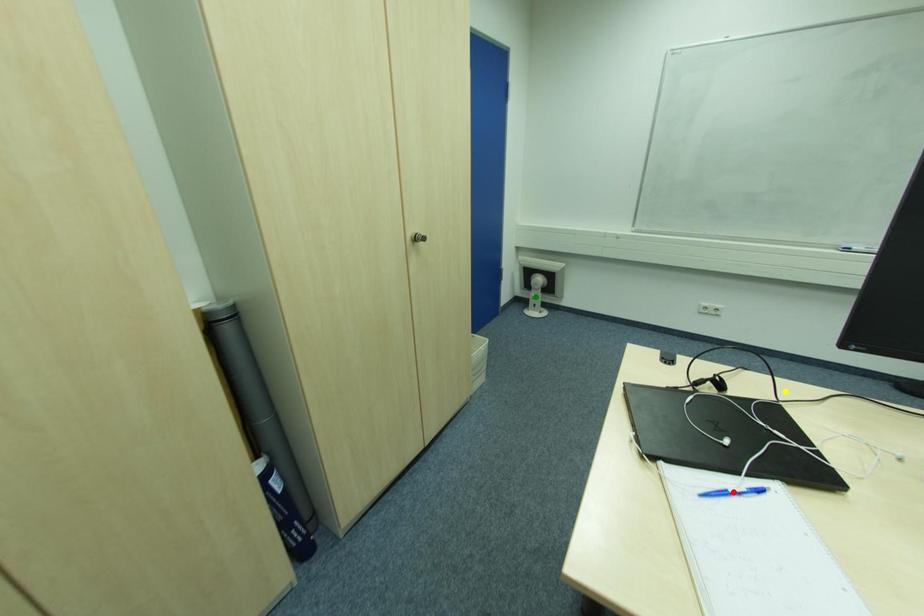
Order these from nearest to farthest:
green point
red point
yellow point

red point → yellow point → green point